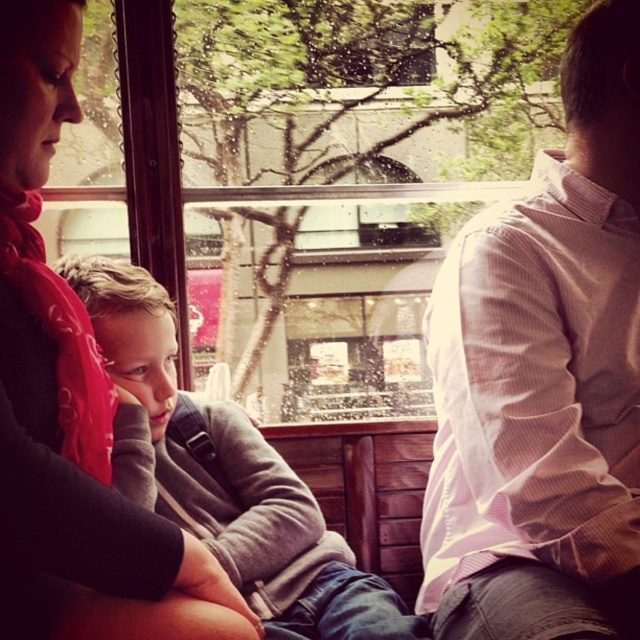
You are a passenger on the train and you want to borrow a pen from someone. You see the white striped shirt at right and the gray fleece sweater at center. Which person is closer to you if you are sitting on the left side of the train?

The gray fleece sweater at center is closer to you because the white striped shirt at right is positioned over it, meaning the white striped shirt at right is further away.

You are a passenger on a train and see the matte red scarf at upper left and the gray fleece sweater at center. Which item is positioned closer to the left side of the train compartment?

The matte red scarf at upper left is positioned closer to the left side of the train compartment because it is to the left of the gray fleece sweater at center.